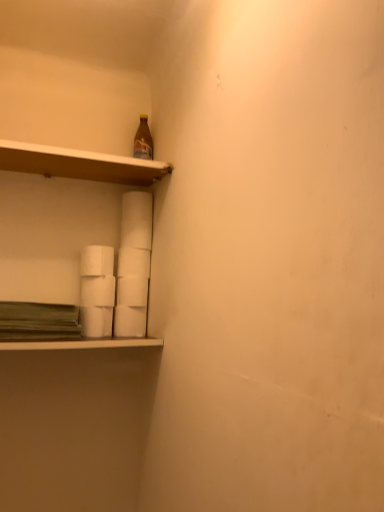
Question: Does point [x=89, y=292] appear closer or farther from the camera than point [x=99, y=329]?

Choices:
 (A) farther
 (B) closer

Answer: (A)

Question: Looking at the image, does white matte paper towel at center, marked as the 4th paper towel in a bottom-to-top arrangement, seem bigger or smaller compared to white matte paper towel at lower left, the 2th paper towel from the bottom?

Choices:
 (A) small
 (B) big

Answer: (B)

Question: Which object is positioned farthest from the wooden shelf at upper left?

Choices:
 (A) white matte paper towel at center, placed as the third paper towel when sorted from bottom to top
 (B) white matte paper towel at lower left, which ranks as the 6th paper towel in bottom-to-top order
 (C) white matte paper towel at lower left, the 2th paper towel from the bottom
 (D) white matte paper towel at center, the third paper towel viewed from the top
 (E) white matte paper towel at center, arranged as the 2th paper towel when viewed from the top

Answer: (C)

Question: Which is nearer to the white matte paper towel at center, which is counted as the fifth paper towel, starting from the bottom?

Choices:
 (A) white matte paper towels at lower center
 (B) white matte paper towel at lower center, which is the first paper towel in bottom-to-top order
 (C) white matte paper towel at lower left, acting as the 1th paper towel starting from the top
 (D) white matte paper towel at center, the fourth paper towel from the top
 (E) white matte paper towel at lower left, the 2th paper towel from the bottom

Answer: (D)